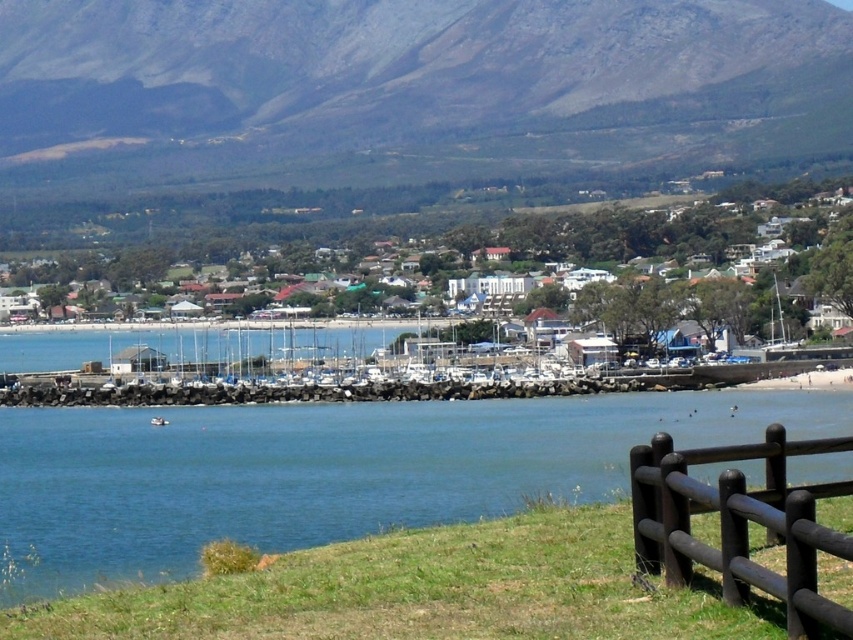
You are a photographer standing in the grassy area at the front of the image. You want to capture a photo that includes both the brown wooden fence at lower right and the white plastic boat at lower center. Which object should you position closer to the edge of your camera frame to ensure both are fully visible?

Since the brown wooden fence at lower right is thinner than the white plastic boat at lower center, you should position the brown wooden fence at lower right closer to the edge of your camera frame to accommodate the wider white plastic boat at lower center and ensure both fit within the shot.

You are standing at the edge of the grassy area near the wooden fence in the lower right corner of the image. You want to take a photo of the white plastic boat at lower center without the blue water at center appearing in the foreground. Is this possible based on their positions?

The blue water at center is closer to the viewer than the white plastic boat at lower center. Since the water is in front of the boat, it would block the view of the boat, making it impossible to take a photo of the white plastic boat at lower center without the blue water at center appearing in the foreground.